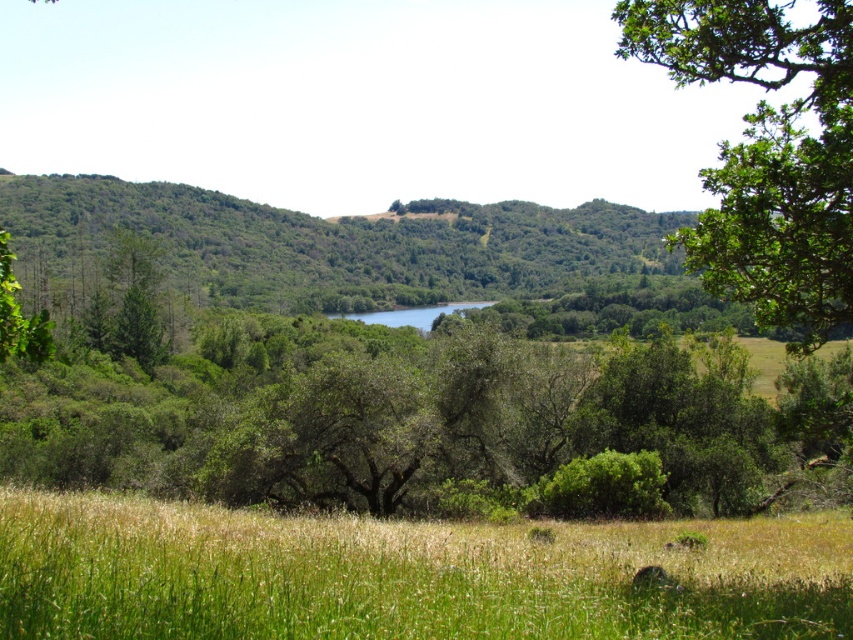
Can you confirm if green leafy tree at center is positioned to the right of green grassy field at lower center?

No, green leafy tree at center is not to the right of green grassy field at lower center.

Is point (340, 342) closer to camera compared to point (553, 593)?

No, it is behind (553, 593).

The width and height of the screenshot is (853, 640). Identify the location of green leafy tree at center. (410, 416).

Which is below, green leafy tree at center or green leafy tree at upper right?

green leafy tree at center is below.

Is green leafy tree at center smaller than green leafy tree at upper right?

No, green leafy tree at center is not smaller than green leafy tree at upper right.

Between point (668, 372) and point (642, 10), which one is positioned in front?

Positioned in front is point (642, 10).

The width and height of the screenshot is (853, 640). Identify the location of green leafy tree at center. (410, 416).

Locate an element on the screen. green grassy field at lower center is located at coordinates (403, 573).

Is point (132, 497) more distant than point (671, 22)?

Yes, it is behind point (671, 22).

This screenshot has width=853, height=640. Describe the element at coordinates (403, 573) in the screenshot. I see `green grassy field at lower center` at that location.

This screenshot has height=640, width=853. I want to click on green grassy field at lower center, so click(403, 573).